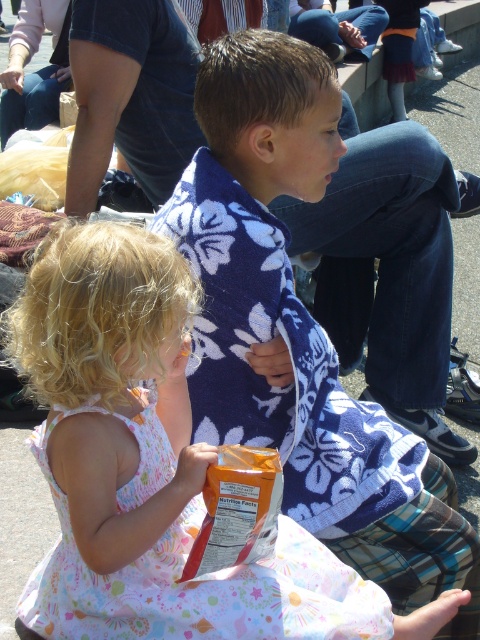
Measure the distance between blue floral towel at center and floral dress at center.

A distance of 16.75 inches exists between blue floral towel at center and floral dress at center.

Does point (264, 195) come behind point (78, 518)?

Yes, point (264, 195) is behind point (78, 518).

Which is behind, point (394, 561) or point (70, 445)?

Point (394, 561)

You are a GUI agent. You are given a task and a screenshot of the screen. Output one action in this format:
    pyautogui.click(x=<x>, y=<y>)
    Task: Click on the blue floral towel at center
    Image resolution: width=480 pixels, height=640 pixels.
    Given the screenshot: What is the action you would take?
    pyautogui.click(x=300, y=332)